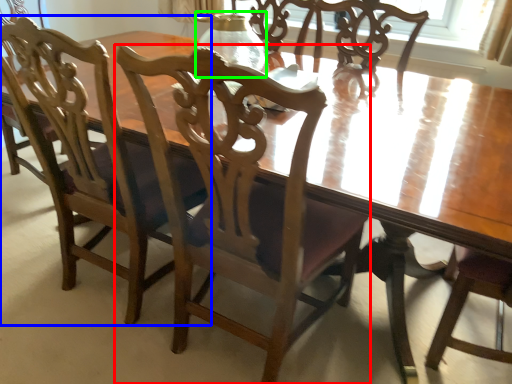
Question: Which object is positioned closest to chair (highlighted by a red box)? Select from chair (highlighted by a blue box) and glass vase (highlighted by a green box).

Choices:
 (A) chair
 (B) glass vase

Answer: (A)